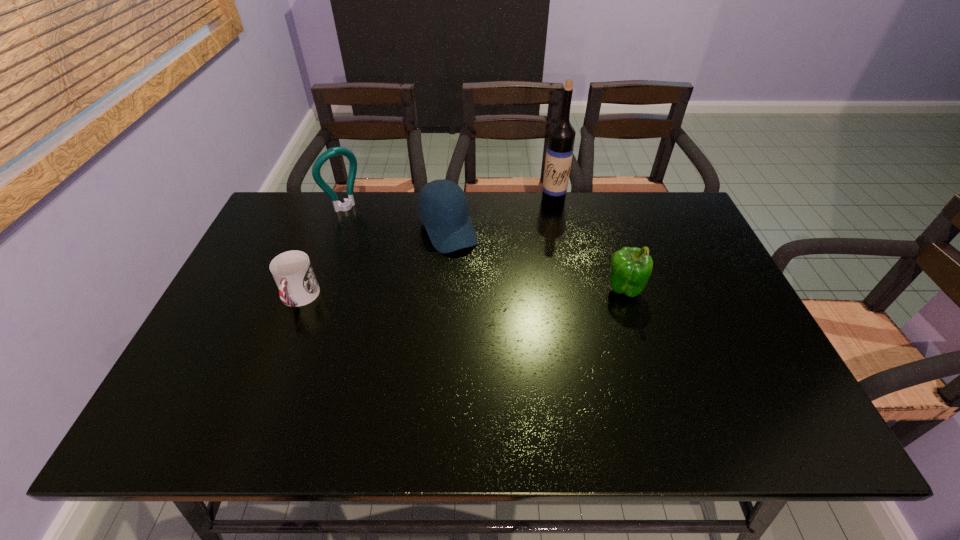
Identify the location of cup. (292, 271).

Locate an element on the screen. This screenshot has width=960, height=540. the third shortest object is located at coordinates (631, 267).

The height and width of the screenshot is (540, 960). In order to click on bell pepper in this screenshot , I will do point(631,267).

Locate an element on the screen. the fourth object from left to right is located at coordinates (559, 152).

Where is `the tallest object`? The width and height of the screenshot is (960, 540). the tallest object is located at coordinates (559, 152).

Locate an element on the screen. This screenshot has height=540, width=960. the third object from left to right is located at coordinates (442, 206).

This screenshot has height=540, width=960. I want to click on baseball cap, so click(442, 206).

This screenshot has width=960, height=540. Find the location of `the fourth shortest object`. the fourth shortest object is located at coordinates (348, 203).

At what (x,y) coordinates should I click in order to perform the action: click on blank space located 0.130m on the side of the shortest object where the handle is located. Please return your answer as a coordinate pair (x, y). Image resolution: width=960 pixels, height=540 pixels. Looking at the image, I should click on (275, 363).

This screenshot has width=960, height=540. What are the coordinates of `vacant space located on the back of the rightmost object` in the screenshot? It's located at (596, 203).